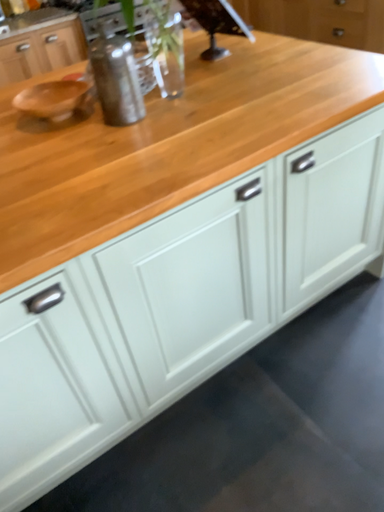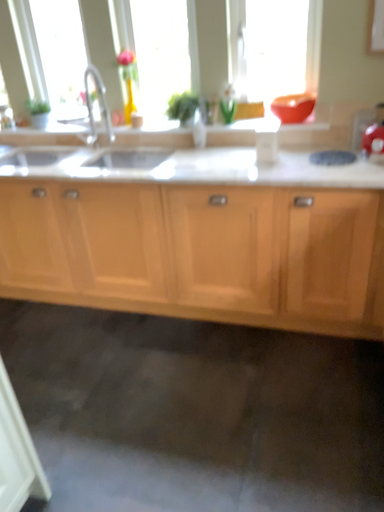
Question: Which way did the camera rotate in the video?

Choices:
 (A) rotated left
 (B) rotated right

Answer: (B)